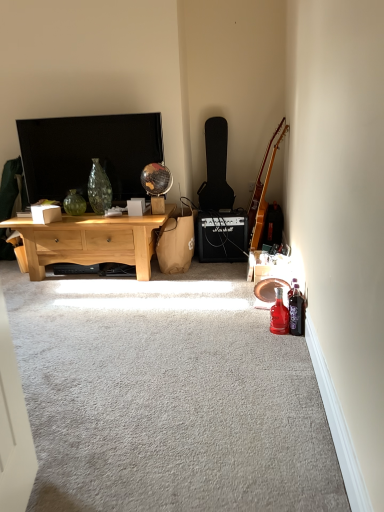
Question: Is green glass vase at center at the back of metallic silver mechanical fan at lower right?

Choices:
 (A) no
 (B) yes

Answer: (A)

Question: From the image's perspective, would you say metallic silver mechanical fan at lower right is shown under green glass vase at center?

Choices:
 (A) yes
 (B) no

Answer: (A)

Question: Is metallic silver mechanical fan at lower right directly adjacent to green glass vase at center?

Choices:
 (A) yes
 (B) no

Answer: (B)

Question: From a real-world perspective, is metallic silver mechanical fan at lower right under green glass vase at center?

Choices:
 (A) no
 (B) yes

Answer: (B)

Question: Is metallic silver mechanical fan at lower right at the left side of green glass vase at center?

Choices:
 (A) no
 (B) yes

Answer: (A)

Question: Can you confirm if metallic silver mechanical fan at lower right is thinner than green glass vase at center?

Choices:
 (A) no
 (B) yes

Answer: (A)

Question: Is glossy wood guitar at right, which is the 2th guitar in back-to-front order, smaller than green glass vase at center?

Choices:
 (A) yes
 (B) no

Answer: (B)

Question: From a real-world perspective, is glossy wood guitar at right, which is the first guitar from front to back, beneath green glass vase at center?

Choices:
 (A) no
 (B) yes

Answer: (A)

Question: Is glossy wood guitar at right, which is the 2th guitar in back-to-front order, thinner than green glass vase at center?

Choices:
 (A) yes
 (B) no

Answer: (B)

Question: Is glossy wood guitar at right, which is the first guitar from front to back, not within green glass vase at center?

Choices:
 (A) yes
 (B) no

Answer: (A)

Question: Is the depth of glossy wood guitar at right, which is the first guitar from right to left, less than that of green glass vase at center?

Choices:
 (A) no
 (B) yes

Answer: (B)

Question: Is glossy wood guitar at right, which is the 2th guitar in back-to-front order, in contact with green glass vase at center?

Choices:
 (A) yes
 (B) no

Answer: (B)

Question: Can you confirm if brown paper bag at center is taller than green glass vase at center?

Choices:
 (A) no
 (B) yes

Answer: (B)